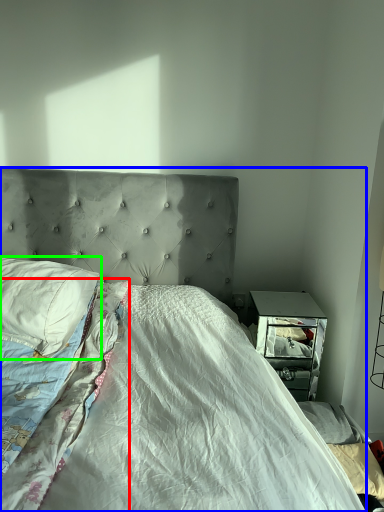
Question: Based on their relative distances, which object is nearer to blanket (highlighted by a red box)? Choose from bed (highlighted by a blue box) and pillow (highlighted by a green box).

Choices:
 (A) bed
 (B) pillow

Answer: (A)